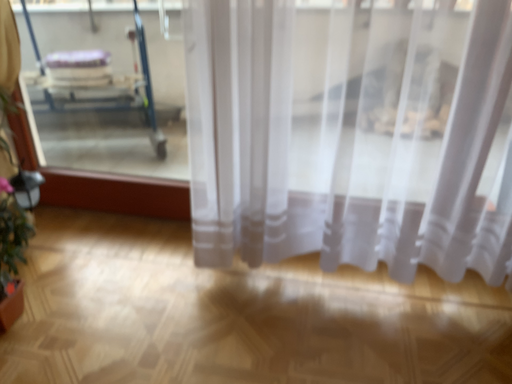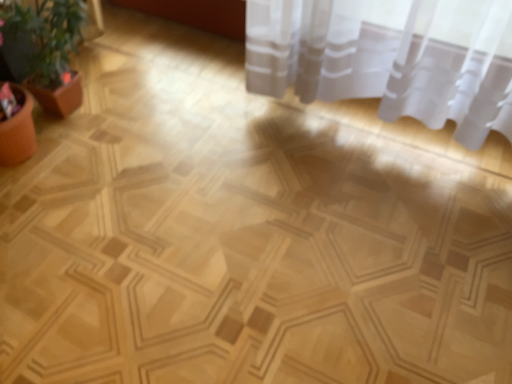
Question: How did the camera likely rotate when shooting the video?

Choices:
 (A) rotated upward
 (B) rotated downward

Answer: (B)